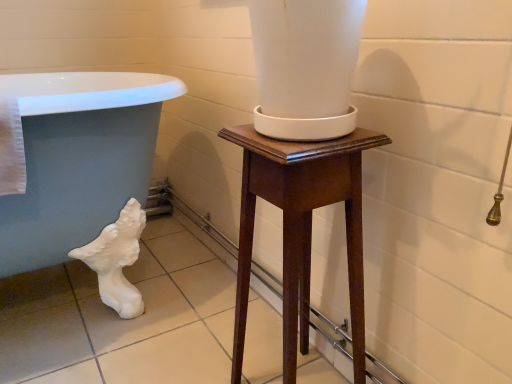
Question: Looking at their shapes, would you say white glossy bath at lower left is wider or thinner than mahogany wood pedestal at center?

Choices:
 (A) thin
 (B) wide

Answer: (B)

Question: From the image's perspective, is white glossy bath at lower left positioned above or below mahogany wood pedestal at center?

Choices:
 (A) below
 (B) above

Answer: (B)

Question: Is white glossy bath at lower left inside or outside of mahogany wood pedestal at center?

Choices:
 (A) inside
 (B) outside

Answer: (B)

Question: Would you say mahogany wood pedestal at center is to the left or to the right of white glossy bath at lower left in the picture?

Choices:
 (A) right
 (B) left

Answer: (A)

Question: Considering the positions of point (368, 137) and point (77, 140), is point (368, 137) closer or farther from the camera than point (77, 140)?

Choices:
 (A) closer
 (B) farther

Answer: (A)

Question: Do you think mahogany wood pedestal at center is within white glossy bath at lower left, or outside of it?

Choices:
 (A) outside
 (B) inside

Answer: (A)

Question: Looking at their shapes, would you say mahogany wood pedestal at center is wider or thinner than white glossy bath at lower left?

Choices:
 (A) wide
 (B) thin

Answer: (B)